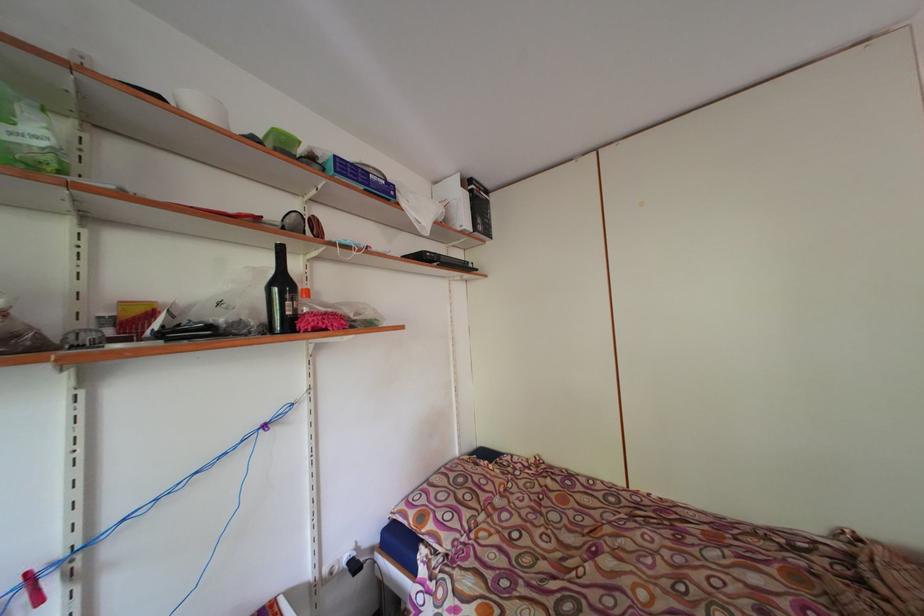
Where is `green plastic container`? green plastic container is located at coordinates (282, 142).